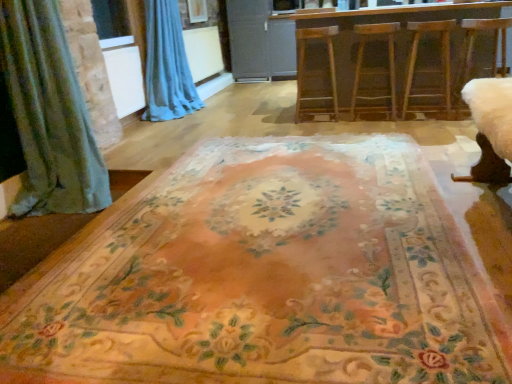
Question: From the image's perspective, is wooden barstools at center above or below white fabric swivel chair at right?

Choices:
 (A) above
 (B) below

Answer: (A)

Question: Considering the positions of wooden barstools at center and white fabric swivel chair at right in the image, is wooden barstools at center wider or thinner than white fabric swivel chair at right?

Choices:
 (A) thin
 (B) wide

Answer: (B)

Question: Which object is positioned closest to the wooden stool at center, positioned as the 2th armchair in right-to-left order?

Choices:
 (A) wooden stool at right, placed as the 1th armchair when sorted from right to left
 (B) floral carpet at center
 (C) wooden stool at center, acting as the first armchair starting from the left
 (D) white fabric swivel chair at right
 (E) matte gray screen door at center

Answer: (A)

Question: Which of these objects is positioned farthest from the wooden stool at right, placed as the 1th armchair when sorted from right to left?

Choices:
 (A) blue fabric curtain at upper left
 (B) wooden stool at center, acting as the first armchair starting from the left
 (C) white fabric swivel chair at right
 (D) matte gray screen door at center
 (E) wooden stool at center, the 2th armchair when ordered from left to right

Answer: (D)